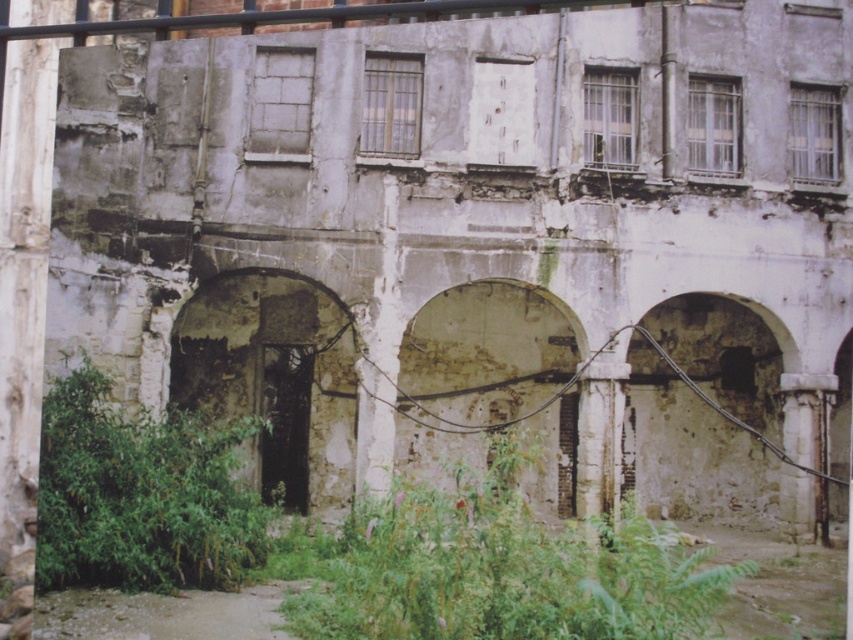
Question: Can you confirm if green leafy plants at center is smaller than rusty stone archway at center left?

Choices:
 (A) yes
 (B) no

Answer: (B)

Question: Which point is farther to the camera?

Choices:
 (A) (62, 408)
 (B) (283, 278)
 (C) (416, 428)
 (D) (335, 564)

Answer: (C)

Question: Is green leafy plant at lower left above weathered stone archway at center?

Choices:
 (A) no
 (B) yes

Answer: (A)

Question: Estimate the real-world distances between objects in this image. Which object is farther from the rusty stone archway at center left?

Choices:
 (A) green leafy plants at center
 (B) green leafy plant at lower left
 (C) weathered stone archway at center

Answer: (B)

Question: Which is farther from the rusty stone archway at center left?

Choices:
 (A) weathered stone archway at center
 (B) green leafy plant at lower left
 (C) green leafy plants at center

Answer: (B)

Question: Can you confirm if green leafy plants at center is positioned to the left of green leafy plant at lower left?

Choices:
 (A) yes
 (B) no

Answer: (B)